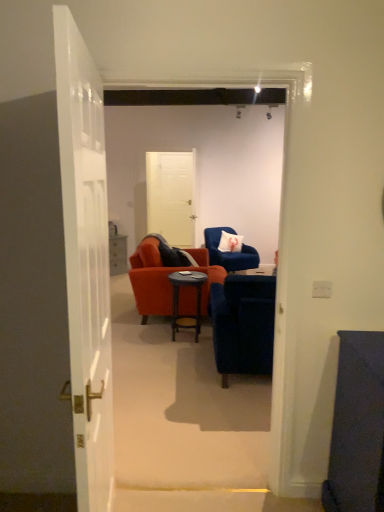
At what (x,y) coordinates should I click in order to perform the action: click on blank space to the left of velvet blue armchair at center, the second chair viewed from the back. Please return your answer as a coordinate pair (x, y). Image resolution: width=384 pixels, height=512 pixels. Looking at the image, I should click on (175, 376).